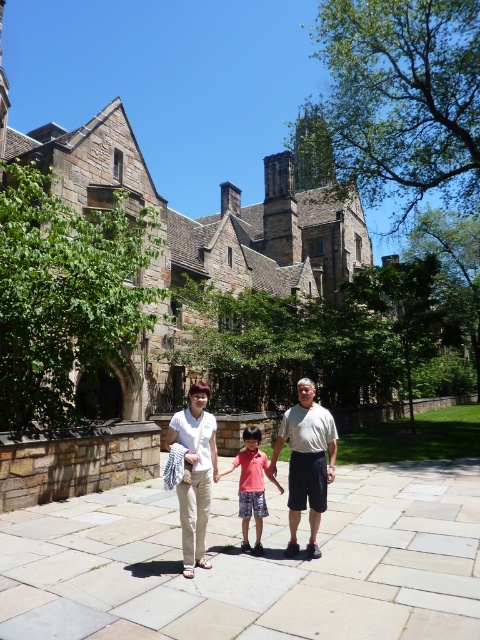
The height and width of the screenshot is (640, 480). Describe the element at coordinates (314, 458) in the screenshot. I see `matte white pants at center` at that location.

Image resolution: width=480 pixels, height=640 pixels. In order to click on matte white pants at center in this screenshot , I will do `click(314, 458)`.

Who is more distant from viewer, (249, 545) or (189, 560)?

Positioned behind is point (249, 545).

Measure the distance between matte white pants at center and camera.

matte white pants at center is 25.44 meters from camera.

Is point (275, 445) less distant than point (183, 516)?

No, it is not.

The image size is (480, 640). Find the location of `matte white pants at center`. matte white pants at center is located at coordinates (314, 458).

Does white cotton shirt at center have a smaller size compared to matte pink shirt at center?

Indeed, white cotton shirt at center has a smaller size compared to matte pink shirt at center.

Is point (280, 448) more distant than point (243, 548)?

Yes, it is behind point (243, 548).

Which is behind, point (291, 547) or point (260, 458)?

Point (260, 458)

Where is `white cotton shirt at center`? This screenshot has width=480, height=640. white cotton shirt at center is located at coordinates (307, 461).